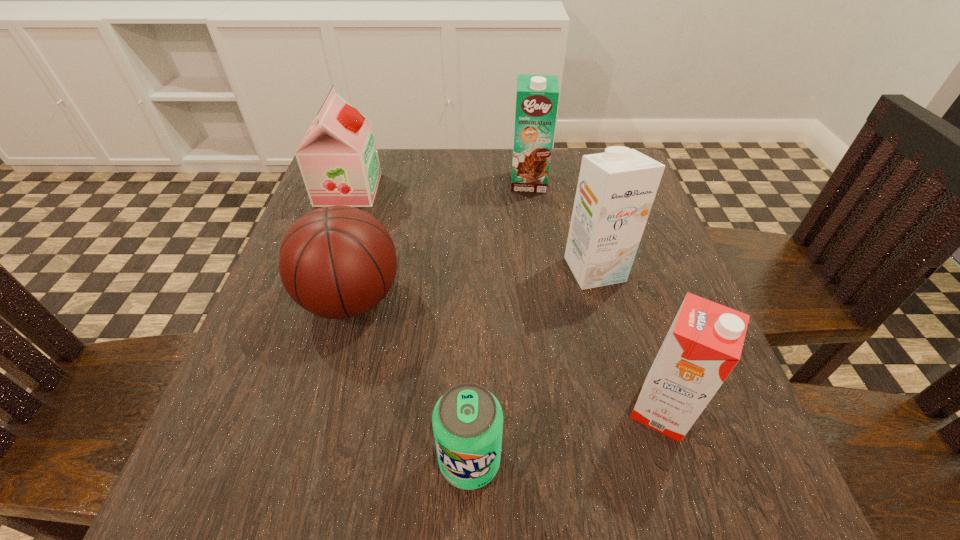
Where is `free spot that satisfies the following two spatial constraints: 1. on the back side of the second shortest object; 2. on the right side of the farthest carton`? This screenshot has height=540, width=960. free spot that satisfies the following two spatial constraints: 1. on the back side of the second shortest object; 2. on the right side of the farthest carton is located at coordinates (383, 182).